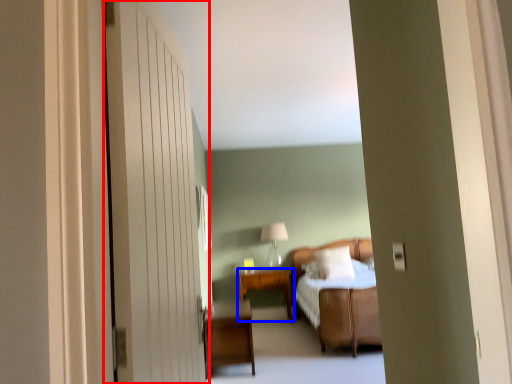
Question: Which object is closer to the camera taking this photo, door (highlighted by a red box) or table (highlighted by a blue box)?

Choices:
 (A) door
 (B) table

Answer: (A)